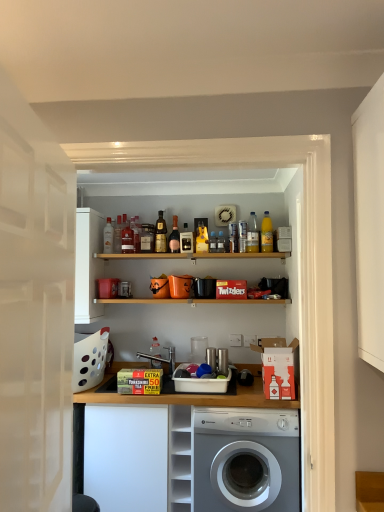
Question: Is white plastic cabinet at lower center turned away from translucent plastic bottle at upper center, placed as the tenth bottle when sorted from left to right?

Choices:
 (A) yes
 (B) no

Answer: (B)

Question: Is there a large distance between white plastic cabinet at lower center and translucent plastic bottle at upper center, the second bottle when ordered from right to left?

Choices:
 (A) no
 (B) yes

Answer: (B)

Question: Can you confirm if white plastic cabinet at lower center is bigger than translucent plastic bottle at upper center, the second bottle when ordered from right to left?

Choices:
 (A) no
 (B) yes

Answer: (B)

Question: Does white plastic cabinet at lower center have a greater width compared to translucent plastic bottle at upper center, the second bottle when ordered from right to left?

Choices:
 (A) yes
 (B) no

Answer: (A)

Question: Would you say white plastic cabinet at lower center contains translucent plastic bottle at upper center, placed as the tenth bottle when sorted from left to right?

Choices:
 (A) no
 (B) yes

Answer: (A)

Question: Is matte glass bottle at upper center, positioned as the 1th bottle in left-to-right order, bigger or smaller than white matte cabinet at lower left?

Choices:
 (A) small
 (B) big

Answer: (A)

Question: Do you think matte glass bottle at upper center, the 11th bottle from the right, is within white matte cabinet at lower left, or outside of it?

Choices:
 (A) outside
 (B) inside

Answer: (A)

Question: From the image's perspective, is matte glass bottle at upper center, the 11th bottle from the right, above or below white matte cabinet at lower left?

Choices:
 (A) above
 (B) below

Answer: (A)

Question: Would you say matte glass bottle at upper center, positioned as the 1th bottle in left-to-right order, is to the left or to the right of white matte cabinet at lower left in the picture?

Choices:
 (A) right
 (B) left

Answer: (B)

Question: Based on their sizes in the image, would you say shiny gold bottle at center, which is the 6th bottle in right-to-left order, is bigger or smaller than white glossy door at left?

Choices:
 (A) big
 (B) small

Answer: (B)

Question: Is point (157, 221) positioned closer to the camera than point (3, 217)?

Choices:
 (A) closer
 (B) farther

Answer: (B)

Question: Considering the relative positions of shiny gold bottle at center, which is the sixth bottle from left to right, and white glossy door at left in the image provided, is shiny gold bottle at center, which is the sixth bottle from left to right, to the left or to the right of white glossy door at left?

Choices:
 (A) right
 (B) left

Answer: (A)

Question: Looking at their shapes, would you say shiny gold bottle at center, which is the 6th bottle in right-to-left order, is wider or thinner than white glossy door at left?

Choices:
 (A) wide
 (B) thin

Answer: (A)

Question: From the image's perspective, is white glossy door at left located above or below white plastic cabinet at lower center?

Choices:
 (A) above
 (B) below

Answer: (A)

Question: Does point (43, 373) appear closer or farther from the camera than point (175, 436)?

Choices:
 (A) farther
 (B) closer

Answer: (B)